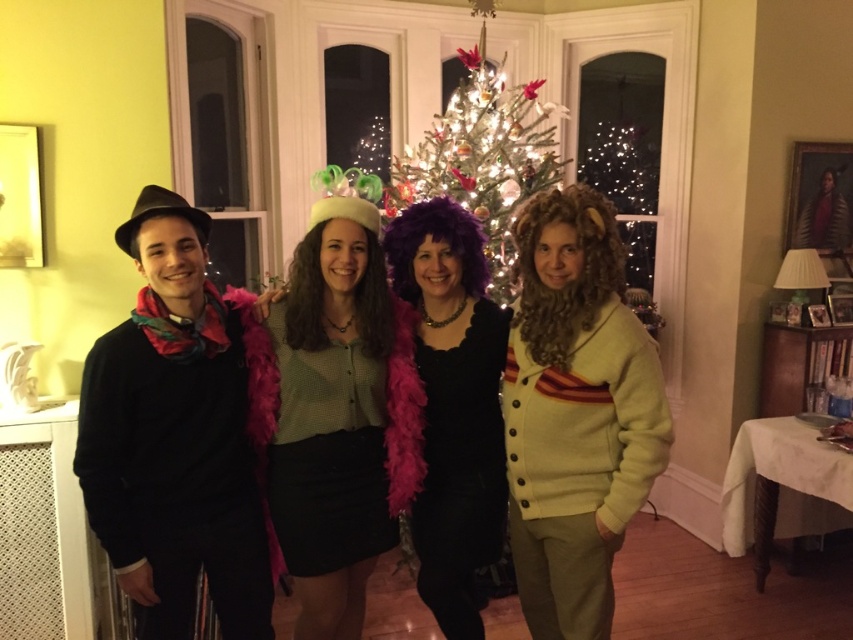
Question: Which object is closer to the camera taking this photo?

Choices:
 (A) light yellow cardigan at right
 (B) matte green blouse at center
 (C) purple feather boa at center
 (D) black matte sweater at left

Answer: (D)

Question: Can you confirm if matte green blouse at center is positioned below shiny silver christmas tree at center?

Choices:
 (A) yes
 (B) no

Answer: (A)

Question: Which point is farther to the camera?

Choices:
 (A) (488, 106)
 (B) (376, 330)
 (C) (407, 298)
 (D) (566, 545)

Answer: (A)

Question: Can you confirm if light yellow cardigan at right is positioned to the right of shiny silver christmas tree at center?

Choices:
 (A) no
 (B) yes

Answer: (B)

Question: Is light yellow cardigan at right positioned before shiny silver christmas tree at center?

Choices:
 (A) yes
 (B) no

Answer: (A)

Question: Which of the following is the farthest from the observer?

Choices:
 (A) (436, 508)
 (B) (354, 609)
 (C) (639, 422)

Answer: (B)